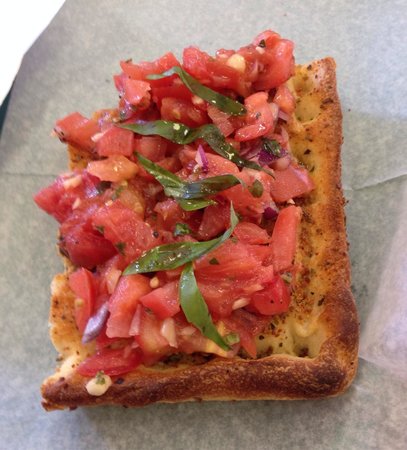
This screenshot has height=450, width=407. Identify the location of gray corner. (392, 10).